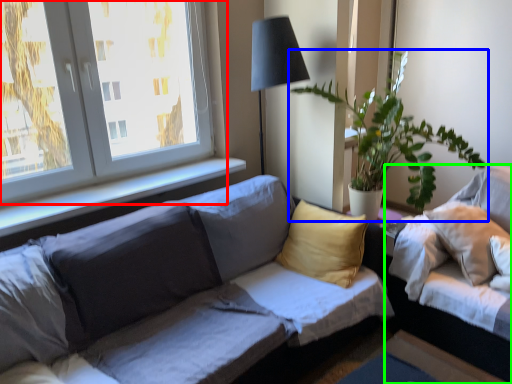
Question: Which is nearer to the window (highlighted by a red box)? houseplant (highlighted by a blue box) or studio couch (highlighted by a green box).

Choices:
 (A) houseplant
 (B) studio couch

Answer: (A)